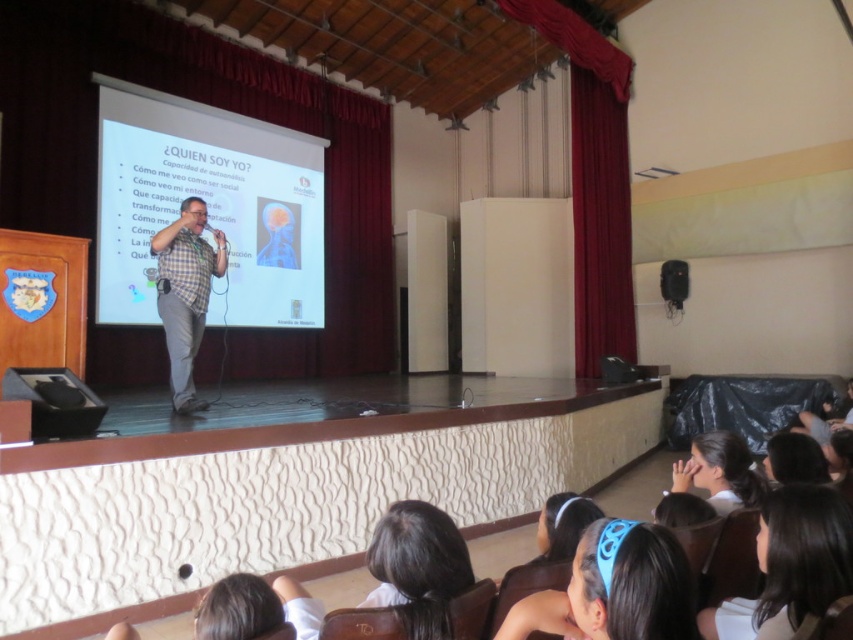
Question: Which is nearer to the black matte speaker at upper right?

Choices:
 (A) dark brown hair at lower right
 (B) smooth white hair at lower right

Answer: (B)

Question: Is blue fabric headband at lower center smaller than black matte speaker at upper right?

Choices:
 (A) yes
 (B) no

Answer: (B)

Question: Is blue fabric headband at lower center positioned before plaid shirt at center?

Choices:
 (A) yes
 (B) no

Answer: (A)

Question: Which point is farther to the camera?

Choices:
 (A) (677, 282)
 (B) (181, 332)
 (C) (808, 525)
 (D) (640, 557)

Answer: (A)

Question: In this image, where is dark brown hair at lower right located relative to smooth white hair at lower right?

Choices:
 (A) right
 (B) left

Answer: (B)

Question: Estimate the real-world distances between objects in this image. Which object is closer to the blue fabric headband at lower center?

Choices:
 (A) white matte projection screen at center
 (B) black matte speaker at upper right
 (C) smooth white hair at lower right

Answer: (C)